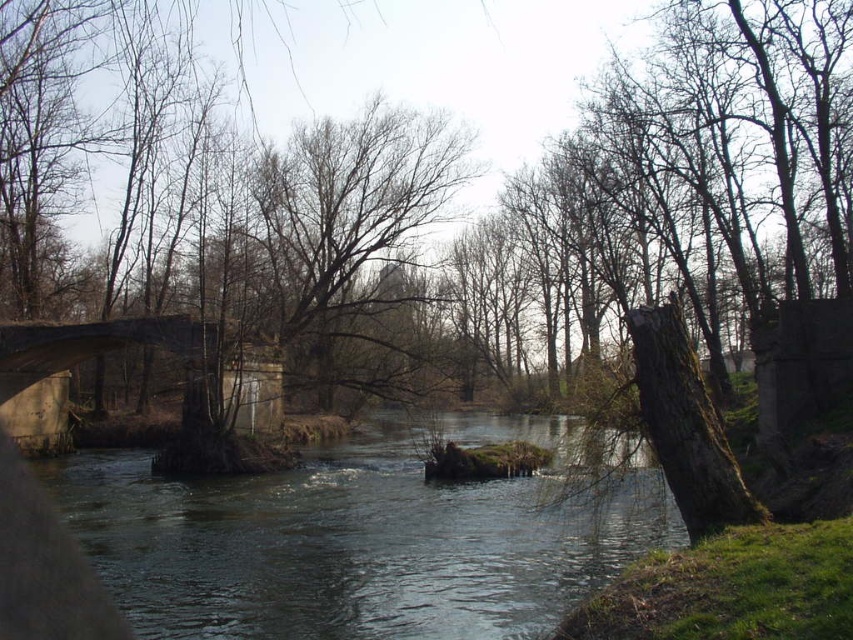
Question: Does bare branches at center appear under concrete bridge at center?

Choices:
 (A) no
 (B) yes

Answer: (A)

Question: Is clear water at center to the left of concrete bridge at center from the viewer's perspective?

Choices:
 (A) yes
 (B) no

Answer: (B)

Question: Among these points, which one is farthest from the camera?

Choices:
 (A) 527,579
 (B) 9,380

Answer: (B)

Question: Among these objects, which one is farthest from the camera?

Choices:
 (A) bare branches at center
 (B) concrete bridge at center
 (C) clear water at center

Answer: (A)

Question: Which is nearer to the clear water at center?

Choices:
 (A) concrete bridge at center
 (B) bare branches at center

Answer: (A)

Question: Can you confirm if clear water at center is bigger than bare branches at center?

Choices:
 (A) yes
 (B) no

Answer: (A)